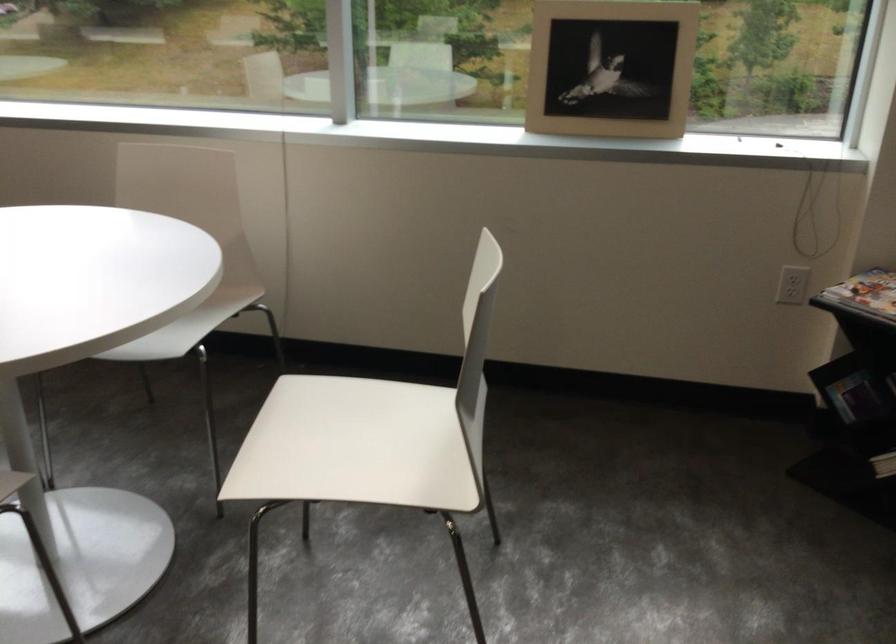
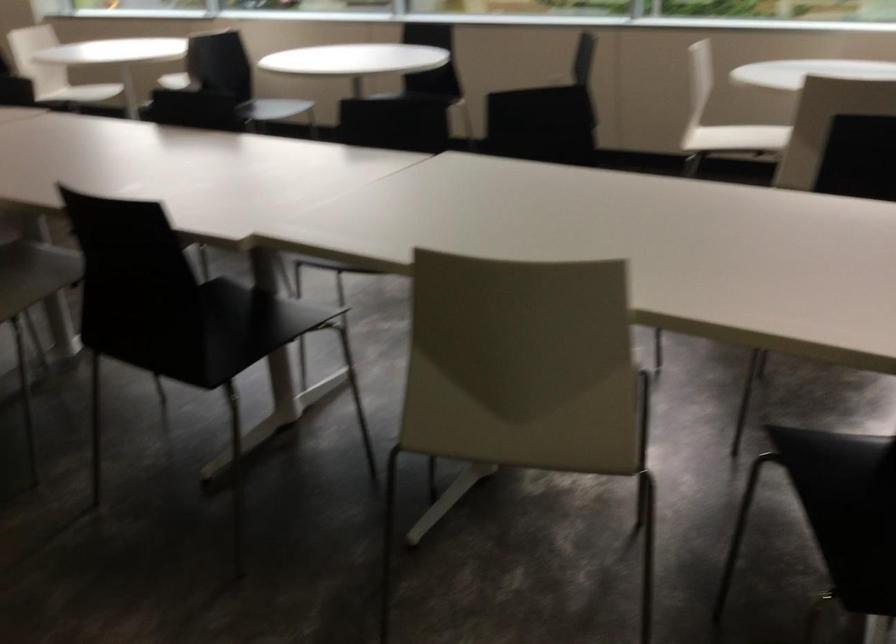
Which direction would the cameraman need to move to produce the second image?

The cameraman walked toward left, backward.